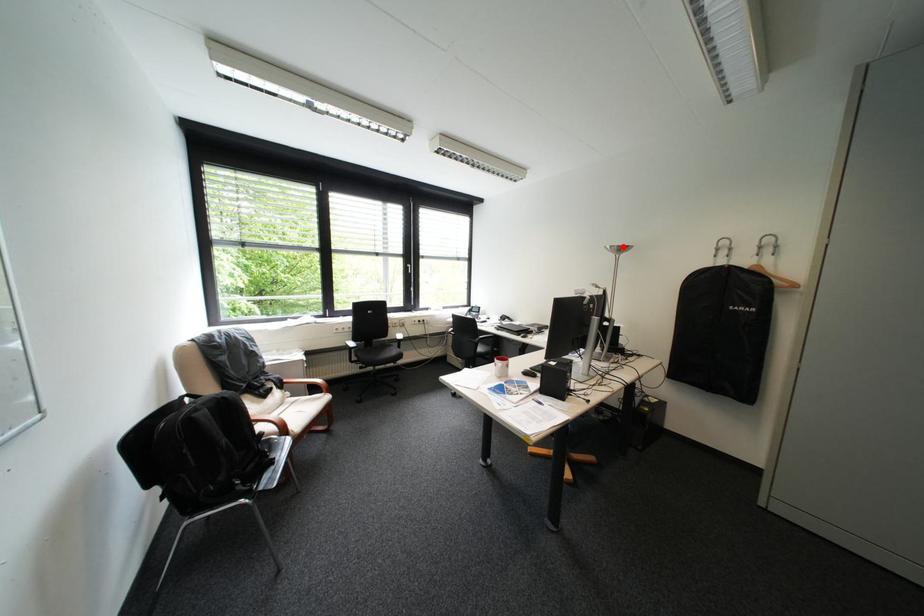
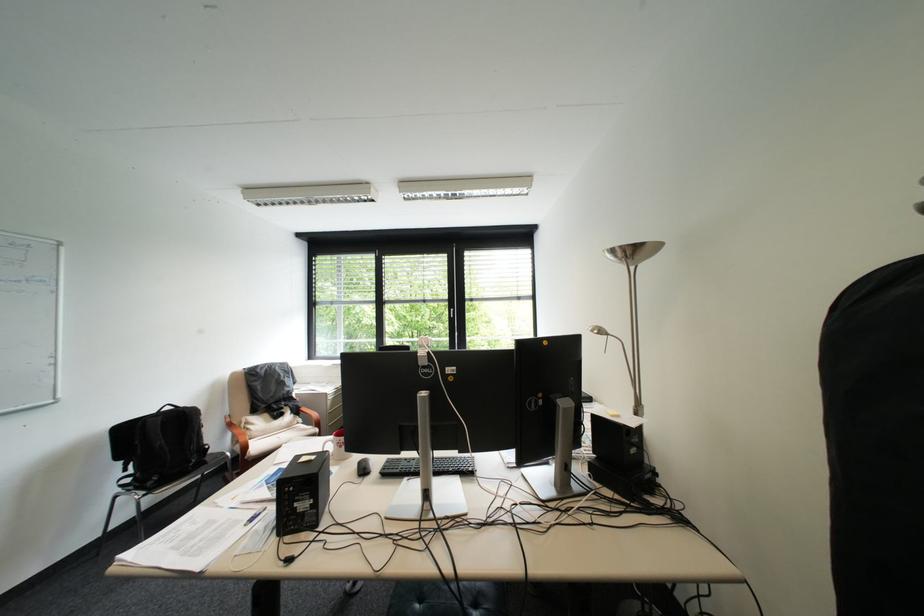
The point at the highlighted location is marked in the first image. Where is the corresponding point in the second image?

(625, 252)